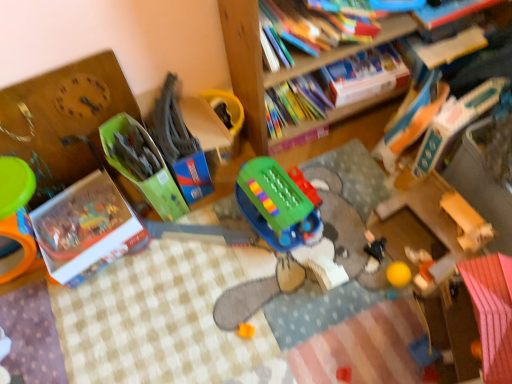
Where is `vacant space to the right of orange matte cube at center, the 4th toy viewed from the right`? vacant space to the right of orange matte cube at center, the 4th toy viewed from the right is located at coordinates (298, 324).